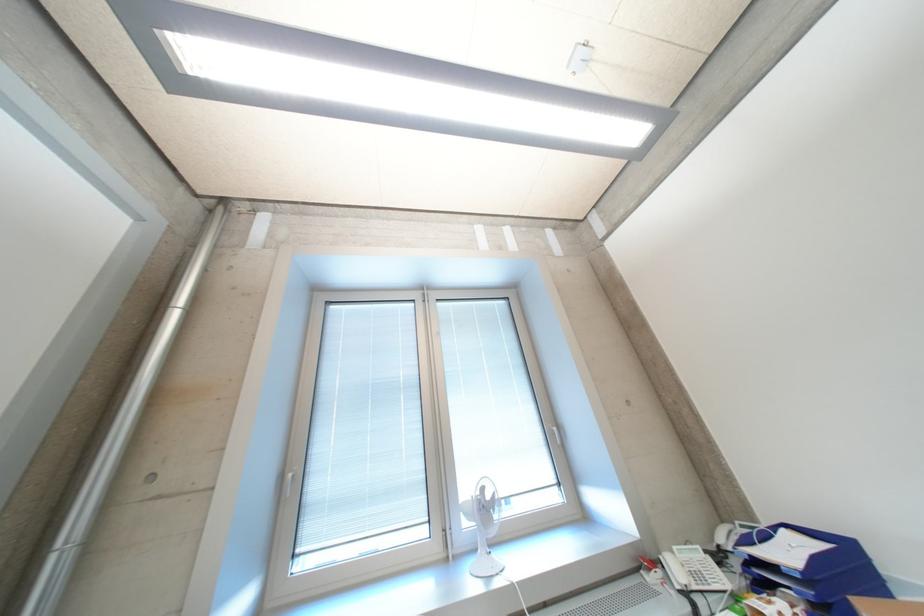
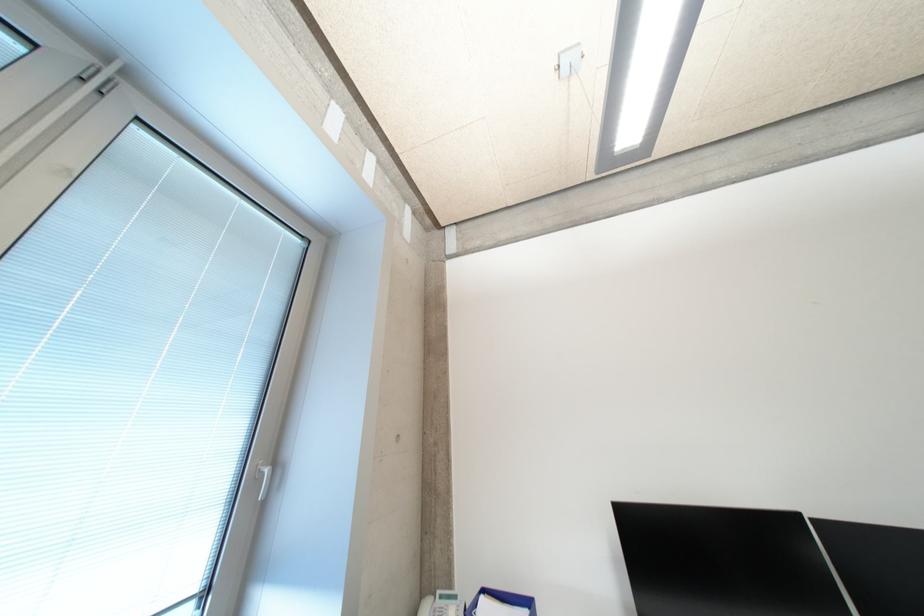
First-person continuous shooting, in which direction is the camera rotating?

The camera's rotation is toward right-up.